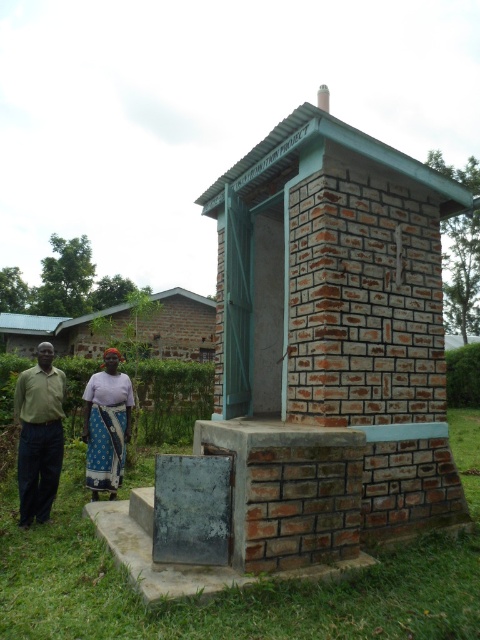
You are a photographer setting up a tripod in front of the brick structure. You notice two items at the lower left corner of your frame. Which item is taller between the blue patterned skirt at lower left and the blue printed fabric at lower left?

The blue patterned skirt at lower left is taller than the blue printed fabric at lower left according to the description.